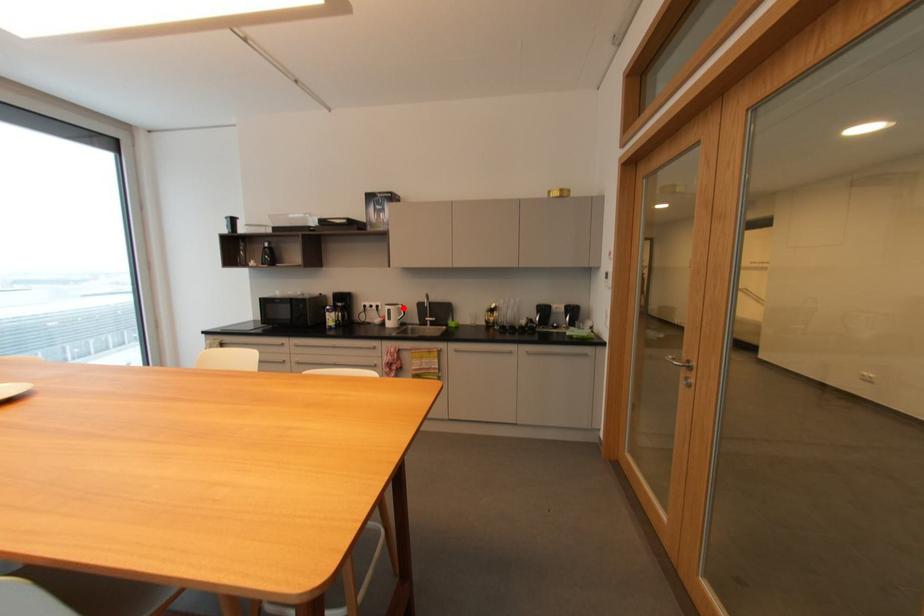
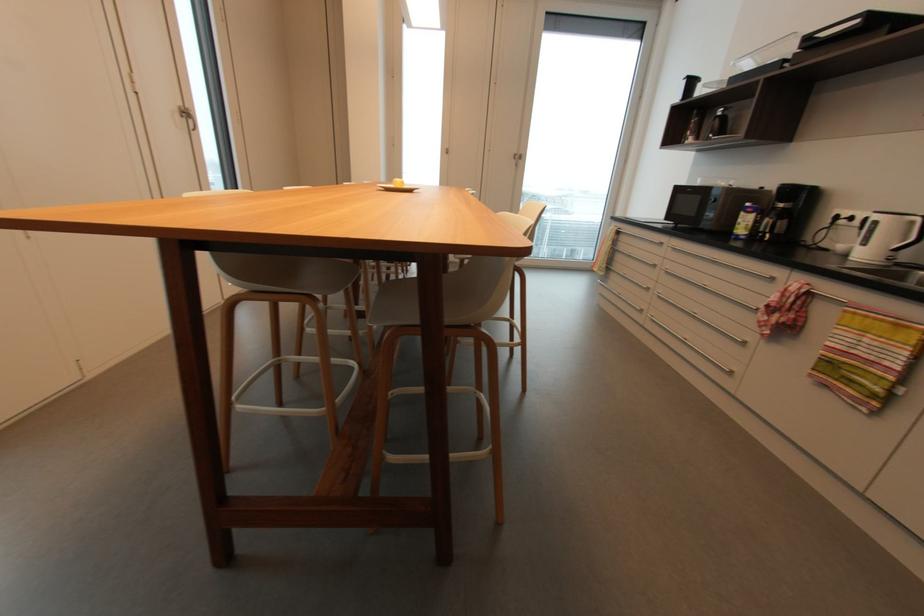
Question: I am providing you with two images of the same scene from different viewpoints. A red point is marked on the first image. Can you still see the location of the red point in image 2?

Choices:
 (A) Yes
 (B) No

Answer: (A)